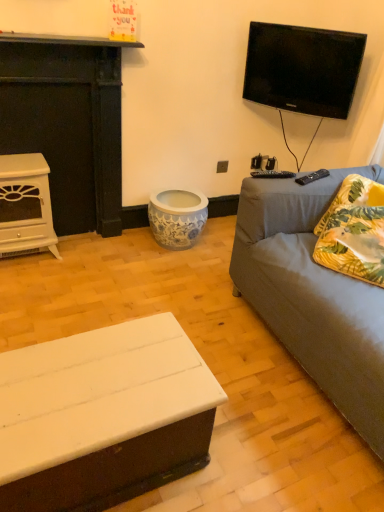
Question: Is white matte coffee table at lower left shorter than black glossy tv at upper right?

Choices:
 (A) yes
 (B) no

Answer: (A)

Question: Considering the relative sizes of white matte coffee table at lower left and black glossy tv at upper right in the image provided, is white matte coffee table at lower left bigger than black glossy tv at upper right?

Choices:
 (A) yes
 (B) no

Answer: (A)

Question: Are white matte coffee table at lower left and black glossy tv at upper right located far from each other?

Choices:
 (A) yes
 (B) no

Answer: (A)

Question: Is white matte coffee table at lower left to the left of black glossy tv at upper right from the viewer's perspective?

Choices:
 (A) yes
 (B) no

Answer: (A)

Question: Is white matte coffee table at lower left behind black glossy tv at upper right?

Choices:
 (A) yes
 (B) no

Answer: (B)

Question: In terms of height, does white glossy fireplace at left, which is counted as the first fireplace, starting from the bottom, look taller or shorter compared to white matte coffee table at lower left?

Choices:
 (A) tall
 (B) short

Answer: (A)

Question: Is white glossy fireplace at left, which is counted as the first fireplace, starting from the bottom, bigger or smaller than white matte coffee table at lower left?

Choices:
 (A) small
 (B) big

Answer: (A)

Question: Looking at their shapes, would you say white glossy fireplace at left, which is counted as the 2th fireplace, starting from the top, is wider or thinner than white matte coffee table at lower left?

Choices:
 (A) wide
 (B) thin

Answer: (B)

Question: Considering the positions of point (46, 166) and point (180, 381), is point (46, 166) closer or farther from the camera than point (180, 381)?

Choices:
 (A) closer
 (B) farther

Answer: (B)

Question: From a real-world perspective, is gray fabric couch at right above or below white glossy fireplace at left, which is counted as the first fireplace, starting from the bottom?

Choices:
 (A) below
 (B) above

Answer: (B)

Question: Is gray fabric couch at right inside the boundaries of white glossy fireplace at left, which is counted as the first fireplace, starting from the bottom, or outside?

Choices:
 (A) outside
 (B) inside

Answer: (A)

Question: Considering the positions of gray fabric couch at right and white glossy fireplace at left, which is counted as the 2th fireplace, starting from the top, in the image, is gray fabric couch at right wider or thinner than white glossy fireplace at left, which is counted as the 2th fireplace, starting from the top,?

Choices:
 (A) wide
 (B) thin

Answer: (A)

Question: From the image's perspective, relative to white glossy fireplace at left, which is counted as the first fireplace, starting from the bottom, is gray fabric couch at right above or below?

Choices:
 (A) above
 (B) below

Answer: (B)

Question: Looking at the image, does white glossy fireplace at left, which is counted as the 2th fireplace, starting from the top, seem bigger or smaller compared to white matte fireplace at left, arranged as the 1th fireplace when viewed from the top?

Choices:
 (A) big
 (B) small

Answer: (B)

Question: From a real-world perspective, is white glossy fireplace at left, which is counted as the first fireplace, starting from the bottom, positioned above or below white matte fireplace at left, arranged as the 1th fireplace when viewed from the top?

Choices:
 (A) above
 (B) below

Answer: (B)